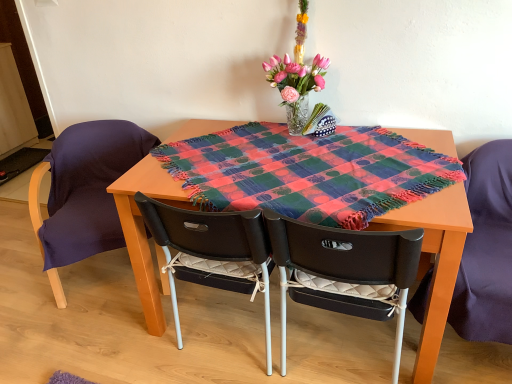
Image resolution: width=512 pixels, height=384 pixels. Describe the element at coordinates (308, 172) in the screenshot. I see `multicolored woven blanket at center` at that location.

Find the location of a particular element. This screenshot has width=512, height=384. multicolored woven blanket at center is located at coordinates (308, 172).

Where is `purple fabric chair at left, which appears as the 4th chair when viewed from the right`? This screenshot has width=512, height=384. purple fabric chair at left, which appears as the 4th chair when viewed from the right is located at coordinates (84, 191).

This screenshot has width=512, height=384. I want to click on black plastic chair with white cushion at center, marked as the 2th chair in a left-to-right arrangement, so click(x=213, y=240).

At what (x,y) coordinates should I click in order to perform the action: click on matte black chair at right, the first chair positioned from the right. Please return your answer as a coordinate pair (x, y). Image resolution: width=512 pixels, height=384 pixels. Looking at the image, I should click on (486, 248).

Find the location of `black quilted cushion at center, the second chair positioned from the right`. black quilted cushion at center, the second chair positioned from the right is located at coordinates (341, 256).

In order to click on multicolored woven blanket at center in this screenshot , I will do `click(308, 172)`.

Considering the relative sizes of pink glass vase at upper center and matte black chair at right, positioned as the 4th chair in left-to-right order, in the image provided, is pink glass vase at upper center smaller than matte black chair at right, positioned as the 4th chair in left-to-right order,?

Indeed, pink glass vase at upper center has a smaller size compared to matte black chair at right, positioned as the 4th chair in left-to-right order.

From the image's perspective, which one is positioned lower, pink glass vase at upper center or matte black chair at right, positioned as the 4th chair in left-to-right order?

From the image's view, matte black chair at right, positioned as the 4th chair in left-to-right order, is below.

Considering their positions, is pink glass vase at upper center located in front of or behind matte black chair at right, the first chair positioned from the right?

Visually, pink glass vase at upper center is located behind matte black chair at right, the first chair positioned from the right.

Can you confirm if pink glass vase at upper center is positioned to the left of matte black chair at right, positioned as the 4th chair in left-to-right order?

Yes, pink glass vase at upper center is to the left of matte black chair at right, positioned as the 4th chair in left-to-right order.

From a real-world perspective, is black quilted cushion at center, which is the 3th chair in left-to-right order, beneath purple fabric chair at left, which appears as the 4th chair when viewed from the right?

No, from a real-world perspective, black quilted cushion at center, which is the 3th chair in left-to-right order, is not beneath purple fabric chair at left, which appears as the 4th chair when viewed from the right.

Is black quilted cushion at center, which is the 3th chair in left-to-right order, next to purple fabric chair at left, placed as the 1th chair when sorted from left to right?

No, black quilted cushion at center, which is the 3th chair in left-to-right order, is not with purple fabric chair at left, placed as the 1th chair when sorted from left to right.

Considering the sizes of black quilted cushion at center, the second chair positioned from the right, and purple fabric chair at left, which appears as the 4th chair when viewed from the right, in the image, is black quilted cushion at center, the second chair positioned from the right, taller or shorter than purple fabric chair at left, which appears as the 4th chair when viewed from the right,?

In the image, black quilted cushion at center, the second chair positioned from the right, appears to be shorter than purple fabric chair at left, which appears as the 4th chair when viewed from the right.

Could you measure the distance between black quilted cushion at center, which is the 3th chair in left-to-right order, and purple fabric chair at left, placed as the 1th chair when sorted from left to right?

The distance of black quilted cushion at center, which is the 3th chair in left-to-right order, from purple fabric chair at left, placed as the 1th chair when sorted from left to right, is 1.13 meters.

Identify the location of chair lying below the black plastic chair with white cushion at center, marked as the 2th chair in a left-to-right arrangement (from the image's perspective). (341, 256).

From the image's perspective, is black quilted cushion at center, which is the 3th chair in left-to-right order, under black plastic chair with white cushion at center, the third chair positioned from the right?

Correct, black quilted cushion at center, which is the 3th chair in left-to-right order, appears lower than black plastic chair with white cushion at center, the third chair positioned from the right, in the image.

Which point is more forward, [416,242] or [162,228]?

The point [416,242] is in front.

Can black plastic chair with white cushion at center, the third chair positioned from the right, be found inside black quilted cushion at center, the second chair positioned from the right?

Definitely not — black plastic chair with white cushion at center, the third chair positioned from the right, is not inside black quilted cushion at center, the second chair positioned from the right.

Between multicolored woven blanket at center and matte black chair at right, positioned as the 4th chair in left-to-right order, which one has less height?

Standing shorter between the two is multicolored woven blanket at center.

Is multicolored woven blanket at center aimed at matte black chair at right, the first chair positioned from the right?

No, multicolored woven blanket at center is not aimed at matte black chair at right, the first chair positioned from the right.

Is point (189, 156) positioned behind point (492, 218)?

Yes, point (189, 156) is behind point (492, 218).

Between multicolored woven blanket at center and matte black chair at right, positioned as the 4th chair in left-to-right order, which one is positioned behind?

matte black chair at right, positioned as the 4th chair in left-to-right order, is behind.

From a real-world perspective, is multicolored woven blanket at center positioned above or below purple fabric chair at left, placed as the 1th chair when sorted from left to right?

multicolored woven blanket at center is situated higher than purple fabric chair at left, placed as the 1th chair when sorted from left to right, in the real world.

Image resolution: width=512 pixels, height=384 pixels. I want to click on the 2nd chair counting from the left side of the multicolored woven blanket at center, so click(84, 191).

Is multicolored woven blanket at center facing away from purple fabric chair at left, placed as the 1th chair when sorted from left to right?

That's not correct — multicolored woven blanket at center is not looking away from purple fabric chair at left, placed as the 1th chair when sorted from left to right.

Is purple fabric chair at left, placed as the 1th chair when sorted from left to right, surrounded by multicolored woven blanket at center?

That's incorrect, purple fabric chair at left, placed as the 1th chair when sorted from left to right, is not inside multicolored woven blanket at center.

From a real-world perspective, is purple fabric chair at left, which appears as the 4th chair when viewed from the right, positioned above or below black plastic chair with white cushion at center, marked as the 2th chair in a left-to-right arrangement?

Clearly, from a real-world perspective, purple fabric chair at left, which appears as the 4th chair when viewed from the right, is above black plastic chair with white cushion at center, marked as the 2th chair in a left-to-right arrangement.

Based on the photo, considering the relative sizes of purple fabric chair at left, which appears as the 4th chair when viewed from the right, and black plastic chair with white cushion at center, the third chair positioned from the right, in the image provided, is purple fabric chair at left, which appears as the 4th chair when viewed from the right, wider than black plastic chair with white cushion at center, the third chair positioned from the right,?

Correct, the width of purple fabric chair at left, which appears as the 4th chair when viewed from the right, exceeds that of black plastic chair with white cushion at center, the third chair positioned from the right.

Could you tell me if purple fabric chair at left, which appears as the 4th chair when viewed from the right, is facing black plastic chair with white cushion at center, the third chair positioned from the right?

No, purple fabric chair at left, which appears as the 4th chair when viewed from the right, does not turn towards black plastic chair with white cushion at center, the third chair positioned from the right.

Which object is further away from the camera, purple fabric chair at left, placed as the 1th chair when sorted from left to right, or black plastic chair with white cushion at center, marked as the 2th chair in a left-to-right arrangement?

purple fabric chair at left, placed as the 1th chair when sorted from left to right, is further from the camera.

Is multicolored woven blanket at center looking in the opposite direction of black plastic chair with white cushion at center, marked as the 2th chair in a left-to-right arrangement?

Yes, multicolored woven blanket at center's orientation is away from black plastic chair with white cushion at center, marked as the 2th chair in a left-to-right arrangement.

Considering the positions of objects multicolored woven blanket at center and black plastic chair with white cushion at center, the third chair positioned from the right, in the image provided, who is behind, multicolored woven blanket at center or black plastic chair with white cushion at center, the third chair positioned from the right,?

Positioned behind is black plastic chair with white cushion at center, the third chair positioned from the right.

Can black plastic chair with white cushion at center, marked as the 2th chair in a left-to-right arrangement, be found inside multicolored woven blanket at center?

That's incorrect, black plastic chair with white cushion at center, marked as the 2th chair in a left-to-right arrangement, is not inside multicolored woven blanket at center.

From the picture: Is multicolored woven blanket at center taller than black plastic chair with white cushion at center, marked as the 2th chair in a left-to-right arrangement?

No.

Image resolution: width=512 pixels, height=384 pixels. I want to click on floral arrangement located above the matte black chair at right, positioned as the 4th chair in left-to-right order (from the image's perspective), so point(298,79).

Locate an element on the screen. chair that is the 3rd one when counting backward from the black quilted cushion at center, which is the 3th chair in left-to-right order is located at coordinates (84, 191).

Estimate the real-world distances between objects in this image. Which object is closer to black plastic chair with white cushion at center, marked as the 2th chair in a left-to-right arrangement, pink glass vase at upper center or matte black chair at right, the first chair positioned from the right?

Among the two, pink glass vase at upper center is located nearer to black plastic chair with white cushion at center, marked as the 2th chair in a left-to-right arrangement.

Which object lies nearer to the anchor point black plastic chair with white cushion at center, marked as the 2th chair in a left-to-right arrangement, purple fabric chair at left, which appears as the 4th chair when viewed from the right, or pink glass vase at upper center?

purple fabric chair at left, which appears as the 4th chair when viewed from the right, is positioned closer to the anchor black plastic chair with white cushion at center, marked as the 2th chair in a left-to-right arrangement.

Looking at the image, which one is located further to matte black chair at right, positioned as the 4th chair in left-to-right order, black plastic chair with white cushion at center, the third chair positioned from the right, or black quilted cushion at center, which is the 3th chair in left-to-right order?

Among the two, black plastic chair with white cushion at center, the third chair positioned from the right, is located further to matte black chair at right, positioned as the 4th chair in left-to-right order.

Estimate the real-world distances between objects in this image. Which object is closer to pink glass vase at upper center, black quilted cushion at center, the second chair positioned from the right, or matte black chair at right, positioned as the 4th chair in left-to-right order?

Based on the image, black quilted cushion at center, the second chair positioned from the right, appears to be nearer to pink glass vase at upper center.

In the scene shown: Which object lies further to the anchor point black plastic chair with white cushion at center, the third chair positioned from the right, matte black chair at right, the first chair positioned from the right, or pink glass vase at upper center?

matte black chair at right, the first chair positioned from the right, is further to black plastic chair with white cushion at center, the third chair positioned from the right.

From the image, which object appears to be nearer to matte black chair at right, positioned as the 4th chair in left-to-right order, pink glass vase at upper center or black quilted cushion at center, the second chair positioned from the right?

Based on the image, black quilted cushion at center, the second chair positioned from the right, appears to be nearer to matte black chair at right, positioned as the 4th chair in left-to-right order.

Looking at the image, which one is located closer to purple fabric chair at left, placed as the 1th chair when sorted from left to right, black quilted cushion at center, the second chair positioned from the right, or multicolored woven blanket at center?

Based on the image, multicolored woven blanket at center appears to be nearer to purple fabric chair at left, placed as the 1th chair when sorted from left to right.

From the image, which object appears to be farther from black plastic chair with white cushion at center, marked as the 2th chair in a left-to-right arrangement, multicolored woven blanket at center or purple fabric chair at left, placed as the 1th chair when sorted from left to right?

The object further to black plastic chair with white cushion at center, marked as the 2th chair in a left-to-right arrangement, is purple fabric chair at left, placed as the 1th chair when sorted from left to right.

Locate an element on the screen. The width and height of the screenshot is (512, 384). chair between purple fabric chair at left, placed as the 1th chair when sorted from left to right, and black quilted cushion at center, the second chair positioned from the right, in the horizontal direction is located at coordinates (213, 240).

This screenshot has width=512, height=384. I want to click on chair located between purple fabric chair at left, which appears as the 4th chair when viewed from the right, and pink glass vase at upper center in the left-right direction, so coord(213,240).

What are the coordinates of `floral arrangement situated between purple fabric chair at left, which appears as the 4th chair when viewed from the right, and multicolored woven blanket at center from left to right` in the screenshot? It's located at 298,79.

The height and width of the screenshot is (384, 512). In order to click on chair between multicolored woven blanket at center and matte black chair at right, the first chair positioned from the right, from left to right in this screenshot , I will do `click(341, 256)`.